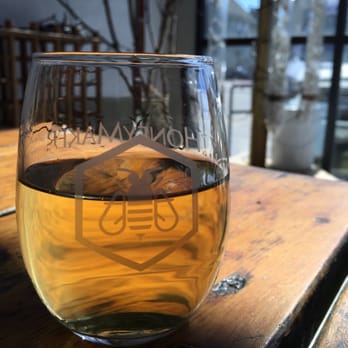
This screenshot has width=348, height=348. I want to click on the front edge of the table, so click(249, 168).